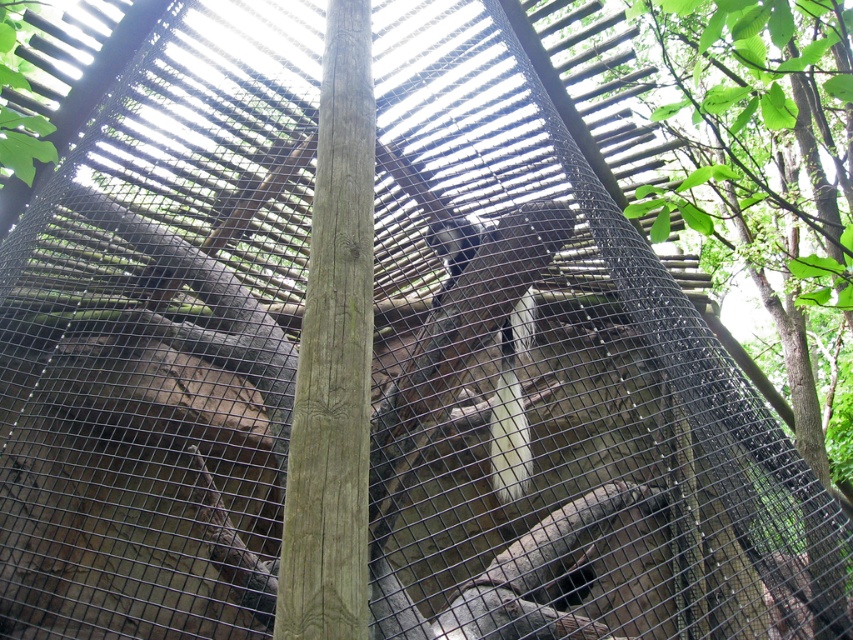
You are a zookeeper observing the primate enclosure. You notice the smooth brown wood pole at center and the white fur monkey at center. Which object is located to the left of the other?

The smooth brown wood pole at center is positioned on the left side of white fur monkey at center.

You are a zookeeper who needs to place a fruit basket for the white fur monkey at center. The basket must be placed on the smooth brown wood pole at center. Is the pole a suitable location for the basket given the monkey is currently below it?

The smooth brown wood pole at center is located above the white fur monkey at center, so placing the fruit basket on the pole would be suitable as the monkey can reach up to it.

You are a zookeeper who needs to place a food bowl for the white fur monkey at center. The bowl requires a minimum of 3 feet of space from the smooth brown wood pole at center to avoid the monkey getting trapped. Can the bowl be placed between them?

The distance between the smooth brown wood pole at center and the white fur monkey at center is 5.29 feet, which is more than the required 3 feet. Therefore, the food bowl can be safely placed between them without risking the monkey getting trapped.